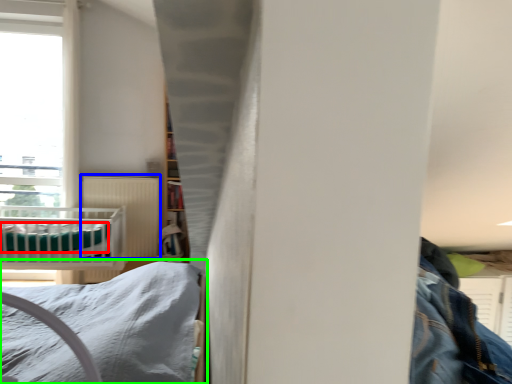
Question: Considering the real-world distances, which object is closest to sheet (highlighted by a red box)? radiator (highlighted by a blue box) or bed (highlighted by a green box).

Choices:
 (A) radiator
 (B) bed

Answer: (A)